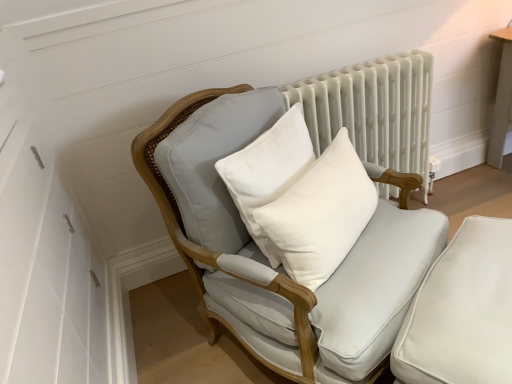
The image size is (512, 384). What do you see at coordinates (374, 114) in the screenshot? I see `white painted radiator at upper center` at bounding box center [374, 114].

What is the approximate width of white fabric chair at center?

91.77 centimeters.

Consider the image. Measure the distance between point (332, 184) and camera.

Point (332, 184) is 4.52 feet away from camera.

What do you see at coordinates (462, 311) in the screenshot?
I see `white leather swivel chair at lower right` at bounding box center [462, 311].

Where is `white painted radiator at upper center`? white painted radiator at upper center is located at coordinates (374, 114).

How different are the orientations of white cotton pillow at center, which is the 1th pillow from right to left, and white cotton pillow at center, the first pillow viewed from the left, in degrees?

The angle between the facing direction of white cotton pillow at center, which is the 1th pillow from right to left, and the facing direction of white cotton pillow at center, the first pillow viewed from the left, is 4.21 degrees.

From the image's perspective, would you say white cotton pillow at center, which is the second pillow in left-to-right order, is shown under white cotton pillow at center, acting as the 2th pillow starting from the right?

Yes.

Is white cotton pillow at center, which is the second pillow in left-to-right order, shorter than white cotton pillow at center, the first pillow viewed from the left?

Correct, white cotton pillow at center, which is the second pillow in left-to-right order, is not as tall as white cotton pillow at center, the first pillow viewed from the left.

Could you measure the distance between white cotton pillow at center, which is the second pillow in left-to-right order, and white cotton pillow at center, the first pillow viewed from the left?

white cotton pillow at center, which is the second pillow in left-to-right order, and white cotton pillow at center, the first pillow viewed from the left, are 4.45 inches apart.

Which is in front, white painted radiator at upper center or white leather swivel chair at lower right?

Positioned in front is white leather swivel chair at lower right.

Is white painted radiator at upper center to the left or to the right of white leather swivel chair at lower right in the image?

Based on their positions, white painted radiator at upper center is located to the left of white leather swivel chair at lower right.

Looking at their sizes, would you say white painted radiator at upper center is wider or thinner than white leather swivel chair at lower right?

Considering their sizes, white painted radiator at upper center looks slimmer than white leather swivel chair at lower right.

From a real-world perspective, is white painted radiator at upper center below white leather swivel chair at lower right?

No, from a real-world perspective, white painted radiator at upper center is not below white leather swivel chair at lower right.

Does white fabric chair at center have a lesser width compared to white cotton pillow at center, acting as the 2th pillow starting from the right?

In fact, white fabric chair at center might be wider than white cotton pillow at center, acting as the 2th pillow starting from the right.

From their relative heights in the image, would you say white fabric chair at center is taller or shorter than white cotton pillow at center, acting as the 2th pillow starting from the right?

Clearly, white fabric chair at center is taller compared to white cotton pillow at center, acting as the 2th pillow starting from the right.

Is white fabric chair at center closer to the viewer compared to white cotton pillow at center, the first pillow viewed from the left?

Yes, white fabric chair at center is closer to the viewer.

From a real-world perspective, is white cotton pillow at center, which is the 1th pillow from right to left, positioned over white fabric chair at center based on gravity?

Indeed, from a real-world perspective, white cotton pillow at center, which is the 1th pillow from right to left, stands above white fabric chair at center.

How far apart are white cotton pillow at center, which is the 1th pillow from right to left, and white fabric chair at center?

A distance of 7.44 inches exists between white cotton pillow at center, which is the 1th pillow from right to left, and white fabric chair at center.

This screenshot has height=384, width=512. Identify the location of chair that appears in front of the white cotton pillow at center, which is the second pillow in left-to-right order. (266, 258).

Based on the photo, how many degrees apart are the facing directions of white cotton pillow at center, which is the 1th pillow from right to left, and white fabric chair at center?

4.23 degrees.

From a real-world perspective, who is located lower, white cotton pillow at center, the first pillow viewed from the left, or white fabric chair at center?

In real-world perspective, white fabric chair at center is lower.

Is white fabric chair at center completely or partially inside white cotton pillow at center, acting as the 2th pillow starting from the right?

→ No, white cotton pillow at center, acting as the 2th pillow starting from the right, does not contain white fabric chair at center.

Which pillow is the 2nd one when counting from the back of the white fabric chair at center? Please provide its 2D coordinates.

[(268, 172)]

Can you tell me how much white cotton pillow at center, acting as the 2th pillow starting from the right, and white fabric chair at center differ in facing direction?

0.02 degrees.

Which is more to the right, white leather swivel chair at lower right or white painted radiator at upper center?

From the viewer's perspective, white leather swivel chair at lower right appears more on the right side.

From the image's perspective, does white leather swivel chair at lower right appear lower than white painted radiator at upper center?

Yes, from the image's perspective, white leather swivel chair at lower right is beneath white painted radiator at upper center.

Considering the sizes of objects white cotton pillow at center, the first pillow viewed from the left, and white leather swivel chair at lower right in the image provided, who is wider, white cotton pillow at center, the first pillow viewed from the left, or white leather swivel chair at lower right?

white leather swivel chair at lower right is wider.

Considering the relative positions of white cotton pillow at center, acting as the 2th pillow starting from the right, and white leather swivel chair at lower right in the image provided, is white cotton pillow at center, acting as the 2th pillow starting from the right, to the left or to the right of white leather swivel chair at lower right?

From the image, it's evident that white cotton pillow at center, acting as the 2th pillow starting from the right, is to the left of white leather swivel chair at lower right.

Consider the image. How many degrees apart are the facing directions of white cotton pillow at center, acting as the 2th pillow starting from the right, and white leather swivel chair at lower right?

The angle between the facing direction of white cotton pillow at center, acting as the 2th pillow starting from the right, and the facing direction of white leather swivel chair at lower right is 0.0199 degrees.

Looking at this image, can you confirm if white cotton pillow at center, the first pillow viewed from the left, is smaller than white leather swivel chair at lower right?

Indeed, white cotton pillow at center, the first pillow viewed from the left, has a smaller size compared to white leather swivel chair at lower right.

Identify the location of pillow above the white cotton pillow at center, which is the 1th pillow from right to left (from a real-world perspective). The width and height of the screenshot is (512, 384). (268, 172).

Identify the location of swivel chair below the white painted radiator at upper center (from the image's perspective). The height and width of the screenshot is (384, 512). (462, 311).

Estimate the real-world distances between objects in this image. Which object is closer to white painted radiator at upper center, white fabric chair at center or white cotton pillow at center, the first pillow viewed from the left?

white fabric chair at center lies closer to white painted radiator at upper center than the other object.

From the image, which object appears to be nearer to white cotton pillow at center, which is the 1th pillow from right to left, white leather swivel chair at lower right or white fabric chair at center?

white fabric chair at center.

Estimate the real-world distances between objects in this image. Which object is further from white leather swivel chair at lower right, white painted radiator at upper center or white cotton pillow at center, the first pillow viewed from the left?

white painted radiator at upper center lies further to white leather swivel chair at lower right than the other object.

Estimate the real-world distances between objects in this image. Which object is closer to white cotton pillow at center, which is the second pillow in left-to-right order, white painted radiator at upper center or white fabric chair at center?

The object closer to white cotton pillow at center, which is the second pillow in left-to-right order, is white fabric chair at center.

In the scene shown: From the image, which object appears to be nearer to white cotton pillow at center, acting as the 2th pillow starting from the right, white painted radiator at upper center or white leather swivel chair at lower right?

The object closer to white cotton pillow at center, acting as the 2th pillow starting from the right, is white leather swivel chair at lower right.

Looking at this image, looking at the image, which one is located further to white leather swivel chair at lower right, white painted radiator at upper center or white cotton pillow at center, which is the second pillow in left-to-right order?

Among the two, white painted radiator at upper center is located further to white leather swivel chair at lower right.

Consider the image. When comparing their distances from white painted radiator at upper center, does white cotton pillow at center, the first pillow viewed from the left, or white leather swivel chair at lower right seem closer?

white cotton pillow at center, the first pillow viewed from the left, is closer to white painted radiator at upper center.

Looking at the image, which one is located further to white leather swivel chair at lower right, white fabric chair at center or white cotton pillow at center, the first pillow viewed from the left?

The object further to white leather swivel chair at lower right is white cotton pillow at center, the first pillow viewed from the left.

The width and height of the screenshot is (512, 384). Find the location of `pillow located between white fabric chair at center and white cotton pillow at center, acting as the 2th pillow starting from the right, in the depth direction`. pillow located between white fabric chair at center and white cotton pillow at center, acting as the 2th pillow starting from the right, in the depth direction is located at coordinates (321, 214).

Where is `swivel chair between white fabric chair at center and white painted radiator at upper center along the z-axis`? The image size is (512, 384). swivel chair between white fabric chair at center and white painted radiator at upper center along the z-axis is located at coordinates (462, 311).

The height and width of the screenshot is (384, 512). Identify the location of pillow positioned between white cotton pillow at center, which is the second pillow in left-to-right order, and white painted radiator at upper center from near to far. (268, 172).

At what (x,y) coordinates should I click in order to perform the action: click on pillow situated between white cotton pillow at center, the first pillow viewed from the left, and white leather swivel chair at lower right from left to right. Please return your answer as a coordinate pair (x, y). Looking at the image, I should click on (321, 214).